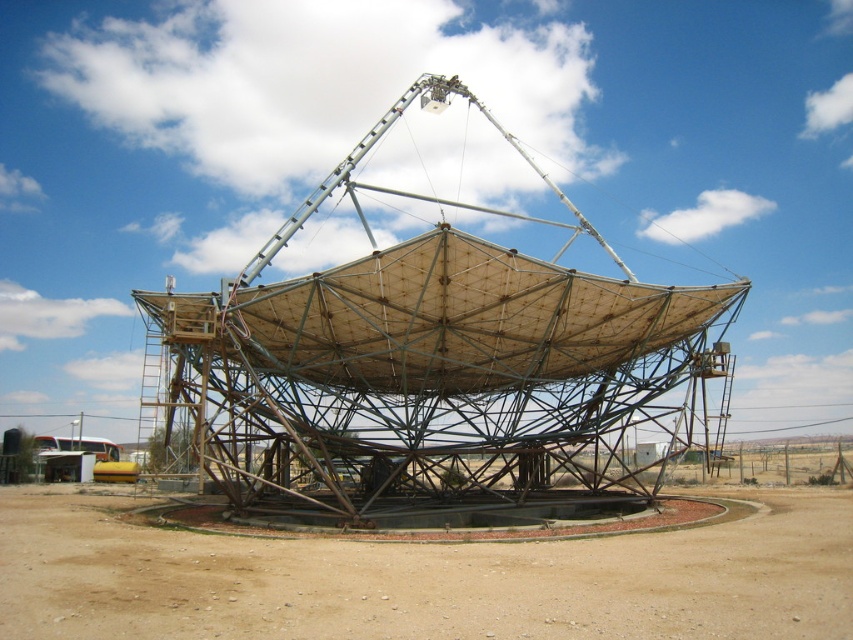
In the scene shown: You are an engineer inspecting the satellite dish setup in the desert. You notice the metallic satellite dish at center and the brown sandy dirt at center. Which object takes up more space in the image?

The metallic satellite dish at center has a larger size compared to the brown sandy dirt at center, so it takes up more space in the image.

You are standing in front of the satellite dish structure in the desert. If you want to take a photo of the entire structure without any part being cut off, how far back should you move from the metallic satellite dish at center?

The metallic satellite dish at center is 99.11 feet from the camera, so you should move back to at least that distance to capture the entire structure in your photo.

You are standing in front of the satellite dish structure in the desert. There is a point labeled at coordinates (434, 371). What object does this point correspond to?

The point at coordinates (434, 371) corresponds to the metallic satellite dish at center.